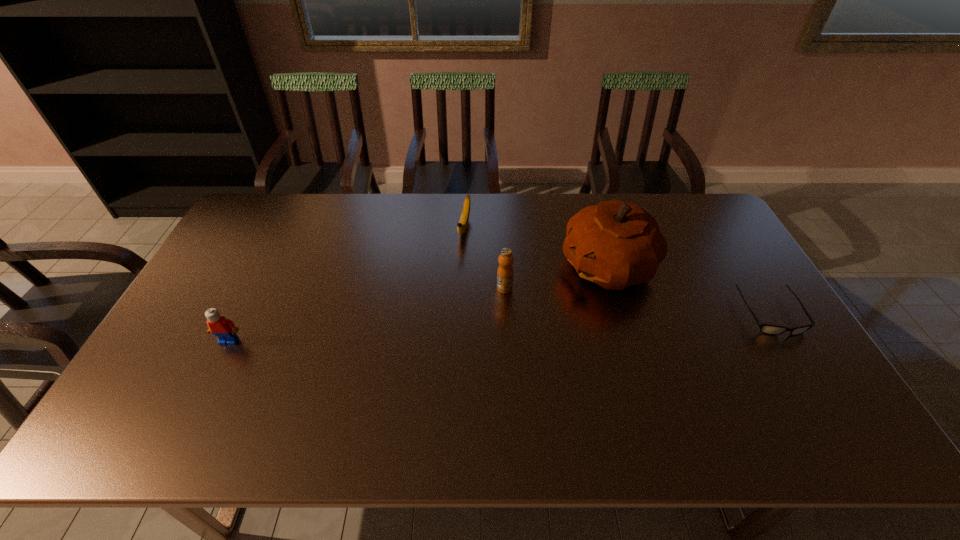
At what (x,y) coordinates should I click in order to perform the action: click on vacant space positioned 0.160m on the face of the third tallest object. Please return your answer as a coordinate pair (x, y). The width and height of the screenshot is (960, 540). Looking at the image, I should click on (200, 399).

Where is `free point located on the front-facing side of the shortest object`? This screenshot has width=960, height=540. free point located on the front-facing side of the shortest object is located at coordinates (820, 395).

At what (x,y) coordinates should I click in order to perform the action: click on free location located 0.130m at the stem of the second object from left to right. Please return your answer as a coordinate pair (x, y). Looking at the image, I should click on (456, 273).

Where is `free space located at the stem of the second object from left to right`? The width and height of the screenshot is (960, 540). free space located at the stem of the second object from left to right is located at coordinates (454, 282).

Where is `vacant space located 0.350m at the stem of the second object from left to right`? The width and height of the screenshot is (960, 540). vacant space located 0.350m at the stem of the second object from left to right is located at coordinates (443, 328).

This screenshot has height=540, width=960. In order to click on free space located on the front-facing side of the fourth object from left to right in this screenshot , I will do `click(479, 349)`.

I want to click on free space located on the front-facing side of the fourth object from left to right, so pyautogui.click(x=529, y=317).

Locate an element on the screen. The width and height of the screenshot is (960, 540). vacant space situated 0.200m on the front-facing side of the fourth object from left to right is located at coordinates (524, 320).

The image size is (960, 540). Identify the location of vacant region located on the front label of the second tallest object. (481, 310).

Identify the location of vacant space located on the front label of the second tallest object. The height and width of the screenshot is (540, 960). (478, 313).